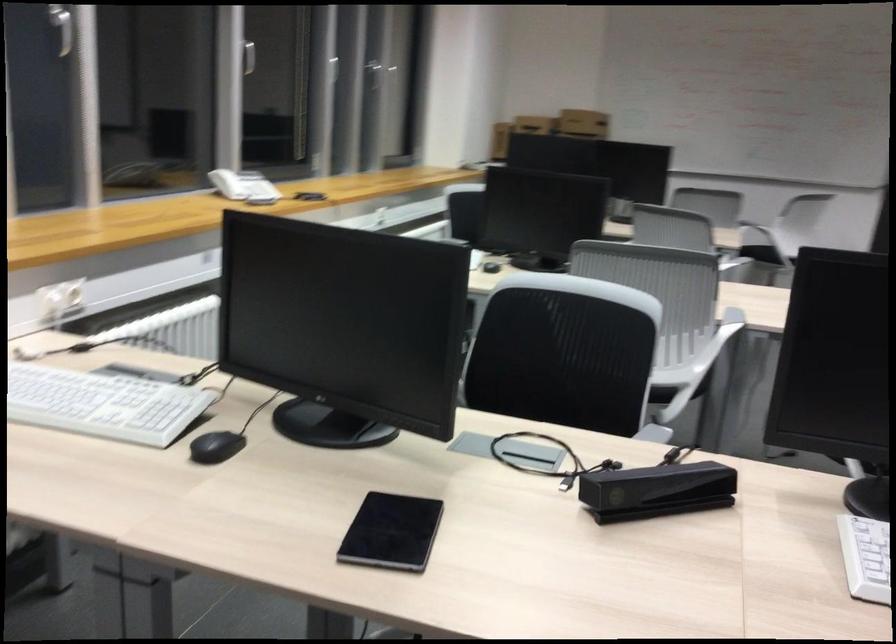
The location [216,447] corresponds to which object?

It refers to a black computer mouse.